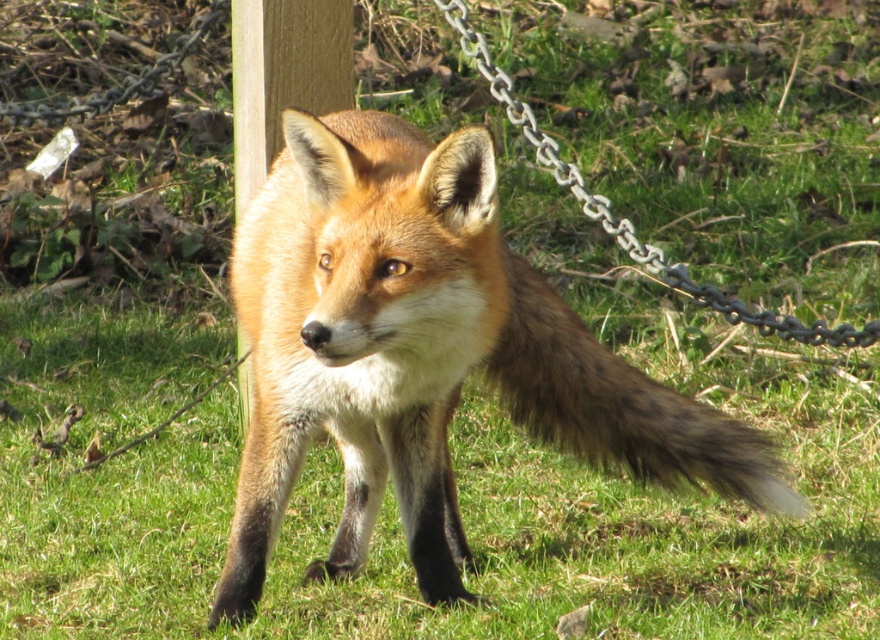
Question: Estimate the real-world distances between objects in this image. Which object is closer to the wooden post at center?

Choices:
 (A) shiny orange fur fox at center
 (B) brown fuzzy tail at center
 (C) metallic silver chain at upper center

Answer: (C)

Question: Which of the following is the farthest from the observer?

Choices:
 (A) (282, 172)
 (B) (232, 129)

Answer: (B)

Question: From the image, what is the correct spatial relationship of brown fuzzy tail at center in relation to metallic silver chain at upper center?

Choices:
 (A) left
 (B) right

Answer: (B)

Question: Does shiny orange fur fox at center appear over brown fuzzy tail at center?

Choices:
 (A) no
 (B) yes

Answer: (A)

Question: Does shiny orange fur fox at center appear over metallic silver chain at upper center?

Choices:
 (A) no
 (B) yes

Answer: (A)

Question: Based on their relative distances, which object is nearer to the brown fuzzy tail at center?

Choices:
 (A) shiny orange fur fox at center
 (B) wooden post at center

Answer: (A)